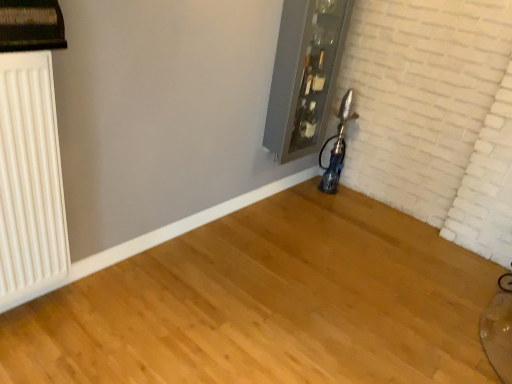
Question: Is metallic glass at upper center outside white matte radiator at left?

Choices:
 (A) yes
 (B) no

Answer: (A)

Question: Can you confirm if metallic glass at upper center is bigger than white matte radiator at left?

Choices:
 (A) yes
 (B) no

Answer: (A)

Question: From the image's perspective, is metallic glass at upper center under white matte radiator at left?

Choices:
 (A) no
 (B) yes

Answer: (A)

Question: From a real-world perspective, is metallic glass at upper center positioned under white matte radiator at left based on gravity?

Choices:
 (A) yes
 (B) no

Answer: (B)

Question: From a real-world perspective, is metallic glass at upper center positioned over white matte radiator at left based on gravity?

Choices:
 (A) yes
 (B) no

Answer: (A)

Question: Is metallic glass at upper center oriented towards white matte radiator at left?

Choices:
 (A) no
 (B) yes

Answer: (A)

Question: Is white matte radiator at left oriented towards metallic glass at upper center?

Choices:
 (A) no
 (B) yes

Answer: (A)

Question: Is metallic glass at upper center located within white matte radiator at left?

Choices:
 (A) yes
 (B) no

Answer: (B)

Question: From the image's perspective, does white matte radiator at left appear higher than metallic glass at upper center?

Choices:
 (A) no
 (B) yes

Answer: (A)

Question: Is white matte radiator at left shorter than metallic glass at upper center?

Choices:
 (A) yes
 (B) no

Answer: (A)

Question: Is metallic glass at upper center at the back of white matte radiator at left?

Choices:
 (A) yes
 (B) no

Answer: (B)

Question: Is white matte radiator at left completely or partially outside of metallic glass at upper center?

Choices:
 (A) yes
 (B) no

Answer: (A)

Question: From the image's perspective, is white matte radiator at left positioned above or below metallic glass at upper center?

Choices:
 (A) below
 (B) above

Answer: (A)